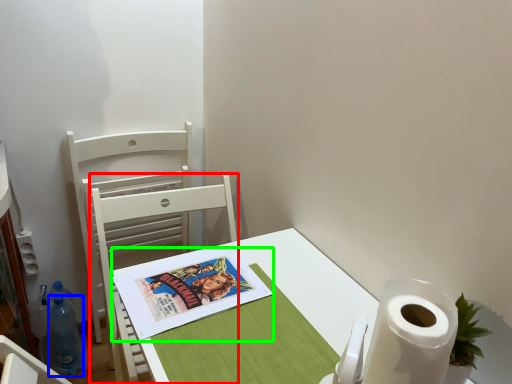
Question: Considering the real-world distances, which object is farthest from chair (highlighted by a red box)? bottle (highlighted by a blue box) or comic book (highlighted by a green box)?

Choices:
 (A) bottle
 (B) comic book

Answer: (A)